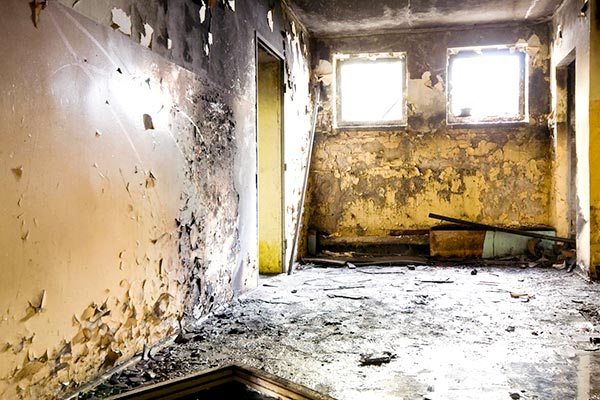
The image size is (600, 400). In order to click on ceiling in this screenshot , I will do `click(361, 14)`.